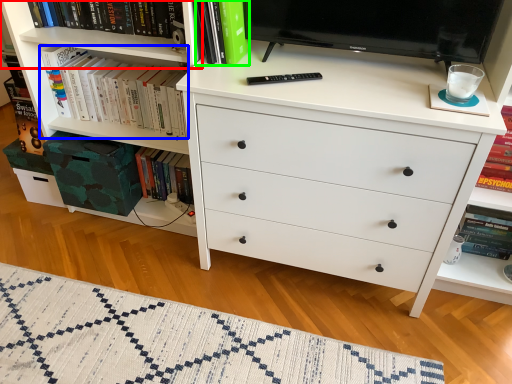
Question: Which is nearer to the shelf (highlighted by a red box)? book (highlighted by a blue box) or book (highlighted by a green box).

Choices:
 (A) book
 (B) book

Answer: (A)